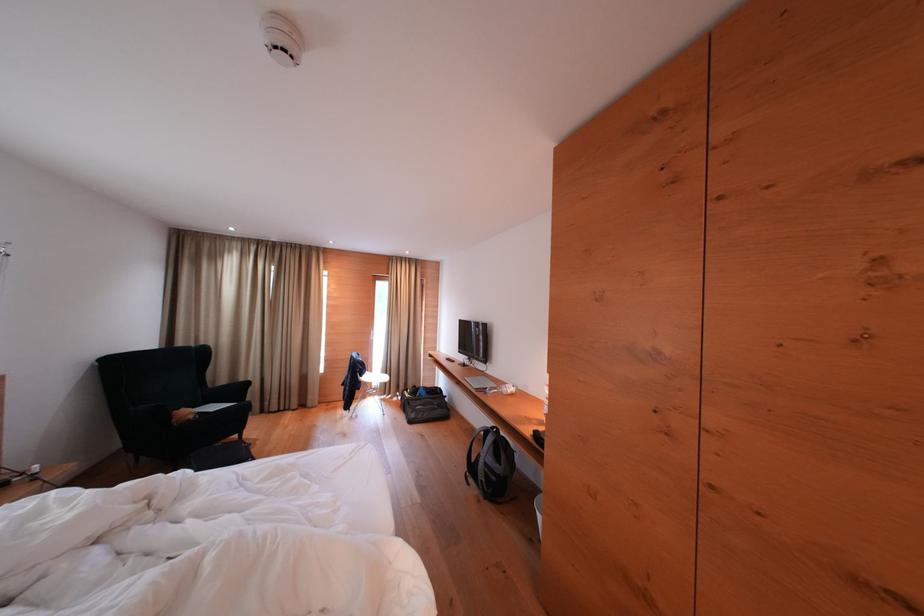
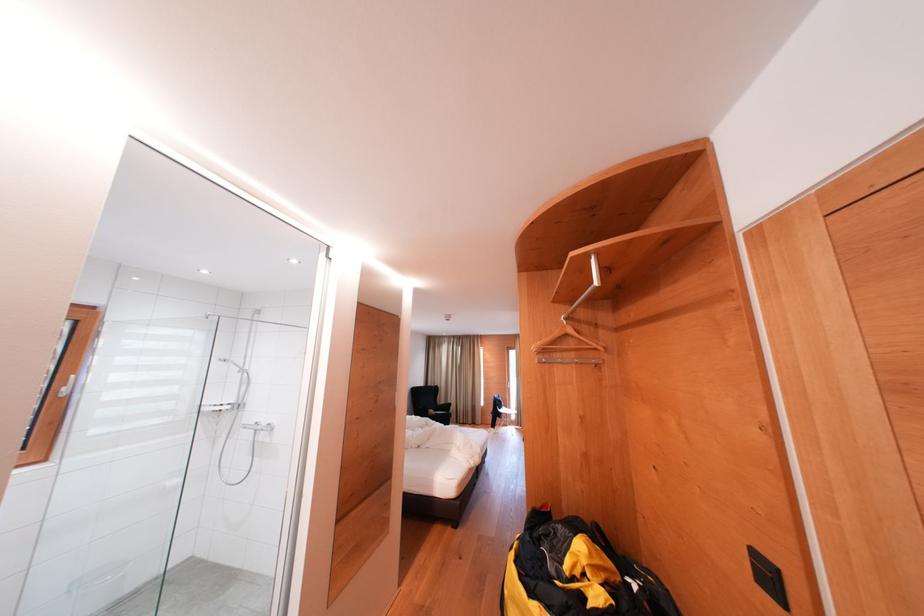
Find the pixel in the second image that matches point (192, 416) in the first image.

(439, 416)